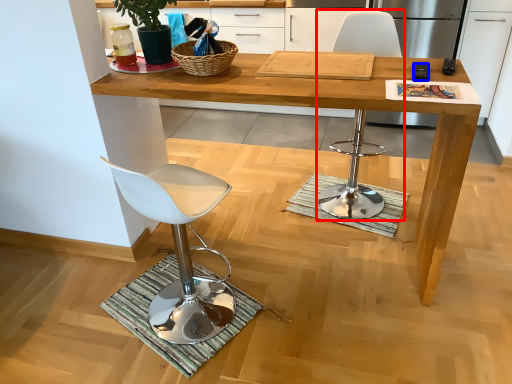
Question: Which point is closer to the camera, chair (highlighted by a red box) or remote control (highlighted by a blue box)?

Choices:
 (A) chair
 (B) remote control

Answer: (B)